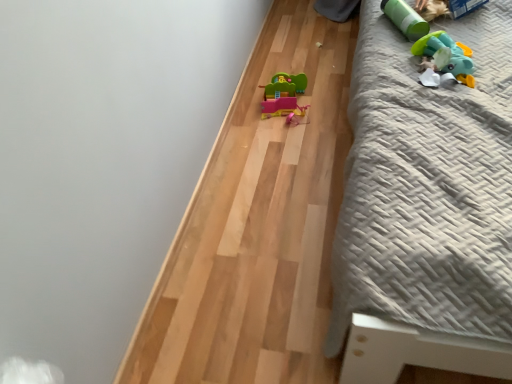
I want to click on free spot to the right of matte plastic toy car at center, the third toy from the front, so click(x=330, y=95).